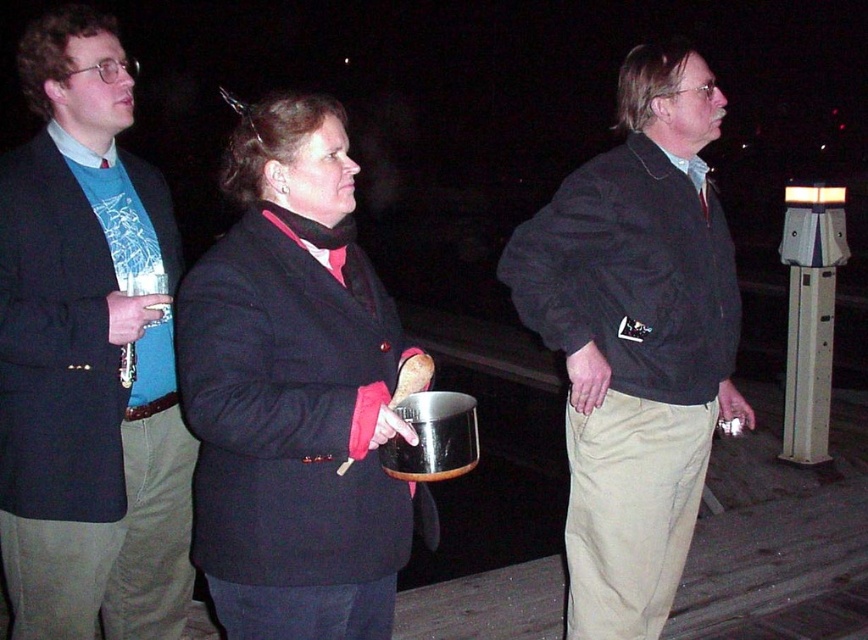
Question: Considering the real-world distances, which object is farthest from the khaki pants at center?

Choices:
 (A) matte black coat at center
 (B) brushed metal flute at left

Answer: (B)

Question: Can you confirm if brushed metal flute at left is wider than matte black coat at center?

Choices:
 (A) yes
 (B) no

Answer: (B)

Question: Which object is positioned farthest from the matte black coat at center?

Choices:
 (A) brushed metal flute at left
 (B) khaki pants at center

Answer: (B)

Question: Can you confirm if brushed metal flute at left is positioned to the left of matte black coat at center?

Choices:
 (A) yes
 (B) no

Answer: (A)

Question: From the image, what is the correct spatial relationship of brushed metal flute at left in relation to khaki pants at center?

Choices:
 (A) left
 (B) right

Answer: (A)

Question: Which object is farther from the camera taking this photo?

Choices:
 (A) matte black coat at center
 (B) brushed metal flute at left
 (C) khaki pants at center

Answer: (C)